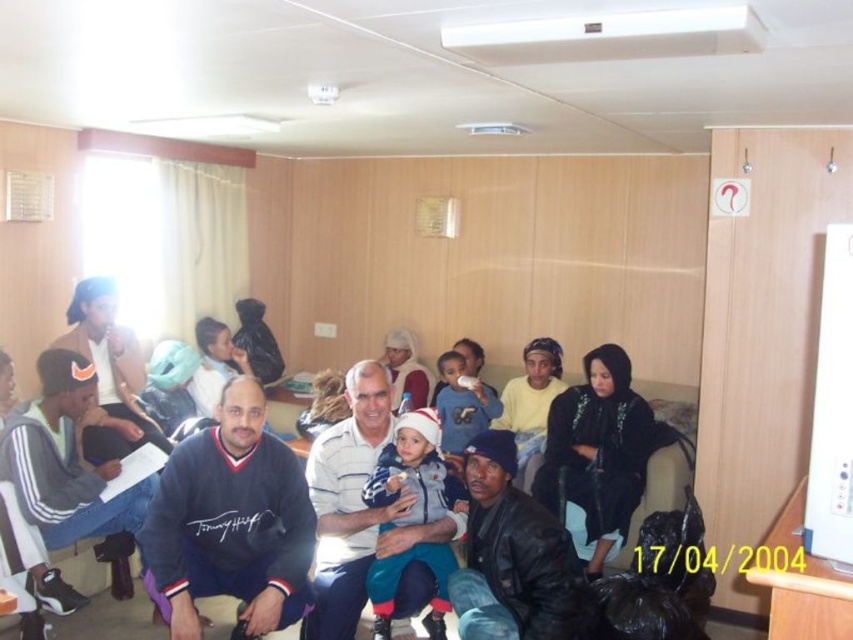
You are standing in the room and want to find the dark blue sweater at center. Where should you look based on the coordinates provided?

The dark blue sweater at center is located at the coordinates point (532, 403).

You are organizing a charity event and need to decide which clothing item to donate between the dark blue sweater at center and the white cotton shirt at center. Based on their sizes, which one would be more suitable for a larger person?

The dark blue sweater at center is bigger than the white cotton shirt at center, so it would be more suitable for a larger person.